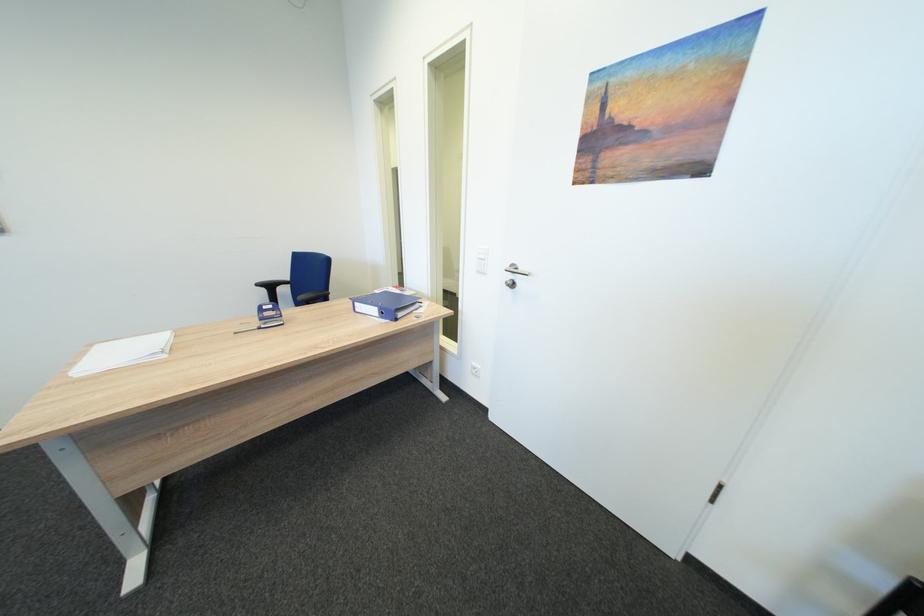
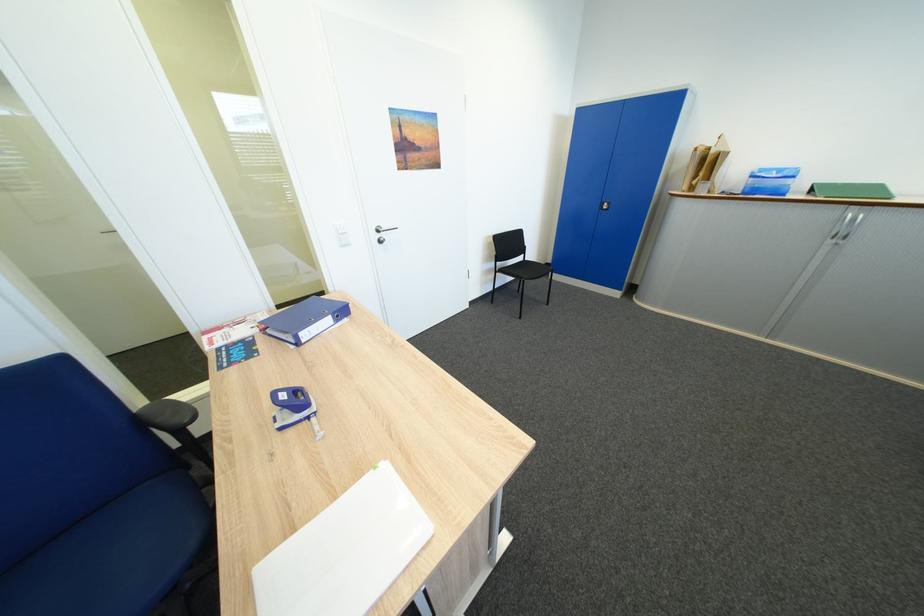
Locate, in the second image, the point that corresponds to [367,305] in the first image.

(310, 334)